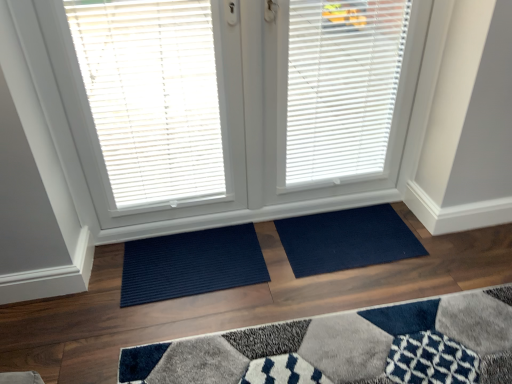
Question: Considering the positions of white matte blinds at center and white matte window blind at center, the 1th window blind from the right, in the image, is white matte blinds at center wider or thinner than white matte window blind at center, the 1th window blind from the right,?

Choices:
 (A) thin
 (B) wide

Answer: (B)

Question: From the image's perspective, is white matte blinds at center positioned above or below white matte window blind at center, which ranks as the second window blind in left-to-right order?

Choices:
 (A) below
 (B) above

Answer: (A)

Question: Considering the real-world distances, which object is closest to the white matte window blind at center, which ranks as the second window blind in left-to-right order?

Choices:
 (A) white matte blinds at center
 (B) white plastic blinds at upper left, which appears as the first window blind when viewed from the left
 (C) navy blue mat at center, the 1th doormat when ordered from right to left
 (D) navy blue textured mat at lower center, which is counted as the first doormat, starting from the left

Answer: (A)

Question: Estimate the real-world distances between objects in this image. Which object is farther from the white plastic blinds at upper left, which ranks as the second window blind in right-to-left order?

Choices:
 (A) navy blue textured mat at lower center, marked as the 2th doormat in a right-to-left arrangement
 (B) navy blue mat at center, the 1th doormat when ordered from right to left
 (C) white matte window blind at center, the 1th window blind from the right
 (D) white matte blinds at center

Answer: (B)